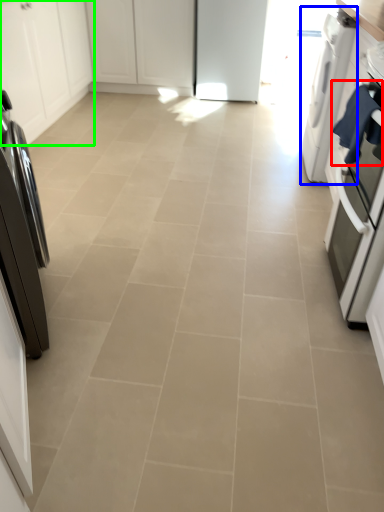
Question: Considering the real-world distances, which object is closest to laundry (highlighted by a red box)? home appliance (highlighted by a blue box) or cabinetry (highlighted by a green box).

Choices:
 (A) home appliance
 (B) cabinetry

Answer: (A)